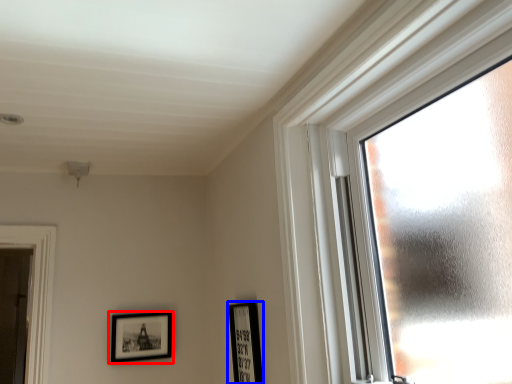
Question: Which of the following is the closest to the observer, picture frame (highlighted by a red box) or picture frame (highlighted by a blue box)?

Choices:
 (A) picture frame
 (B) picture frame

Answer: (B)